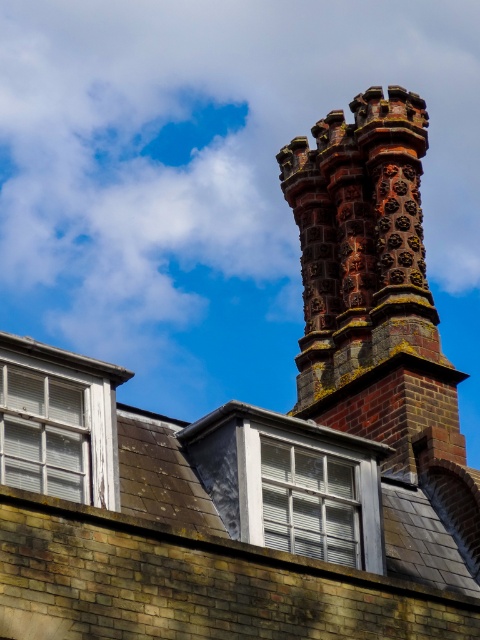
Question: Which object appears farthest from the camera in this image?

Choices:
 (A) white wooden window at upper left
 (B) brown shingles at upper center
 (C) clear glass window at center
 (D) rustic brick chimney at upper center

Answer: (D)

Question: Does rustic brick chimney at upper center appear on the right side of white wooden window at upper left?

Choices:
 (A) no
 (B) yes

Answer: (B)

Question: Among these objects, which one is nearest to the camera?

Choices:
 (A) clear glass window at center
 (B) brown shingles at upper center
 (C) white wooden window at upper left

Answer: (B)

Question: Is brown shingles at upper center above rustic brick chimney at upper center?

Choices:
 (A) yes
 (B) no

Answer: (B)

Question: Is brown shingles at upper center below white wooden window at upper left?

Choices:
 (A) yes
 (B) no

Answer: (A)

Question: Which object appears farthest from the camera in this image?

Choices:
 (A) brown shingles at upper center
 (B) rustic brick chimney at upper center
 (C) white wooden window at upper left

Answer: (B)